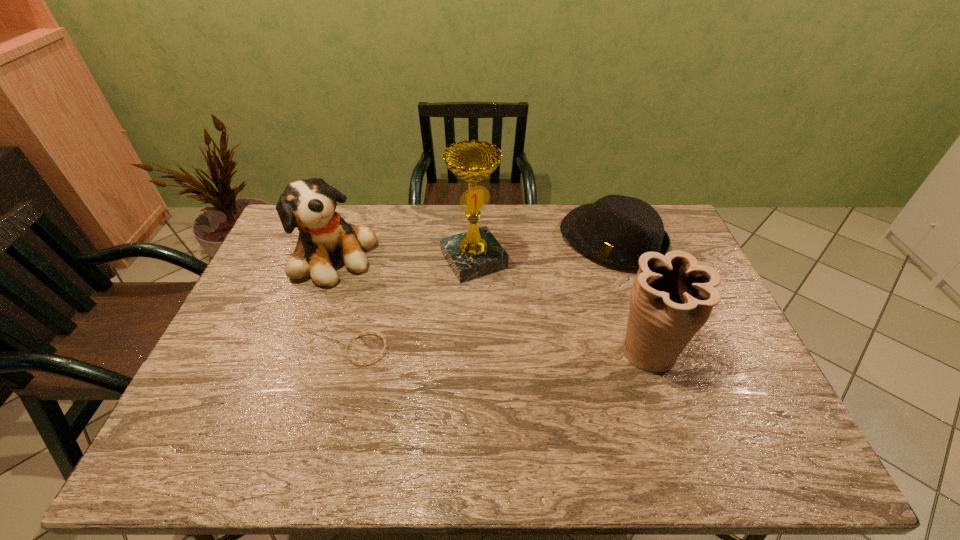
The image size is (960, 540). Find the location of `fedora present at the far edge`. fedora present at the far edge is located at coordinates tap(617, 230).

Find the location of `puppy situated at the far edge`. puppy situated at the far edge is located at coordinates (309, 205).

Locate an element on the screen. object that is positioned at the left edge is located at coordinates (309, 205).

You are a GUI agent. You are given a task and a screenshot of the screen. Output one action in this format:
    pyautogui.click(x=<x>, y=<y>)
    Task: Click on the urn located in the right edge section of the desktop
    Image resolution: width=960 pixels, height=540 pixels.
    Given the screenshot: What is the action you would take?
    tap(672, 297)

You are a GUI agent. You are given a task and a screenshot of the screen. Output one action in this format:
    pyautogui.click(x=<x>, y=<y>)
    Task: Click on the fedora situated at the right edge
    This screenshot has height=540, width=960.
    Given the screenshot: What is the action you would take?
    pyautogui.click(x=617, y=230)

What are the coordinates of `object at the far left corner` in the screenshot? It's located at (309, 205).

Find the location of a particular element. object located at the far right corner is located at coordinates (617, 230).

In the image, there is a desktop. Where is `vacant space at the far edge`? This screenshot has height=540, width=960. vacant space at the far edge is located at coordinates (347, 217).

The image size is (960, 540). In the image, there is a desktop. Find the location of `vacant space at the near edge`. vacant space at the near edge is located at coordinates (576, 416).

Find the location of `free space at the left edge of the desktop`. free space at the left edge of the desktop is located at coordinates (276, 286).